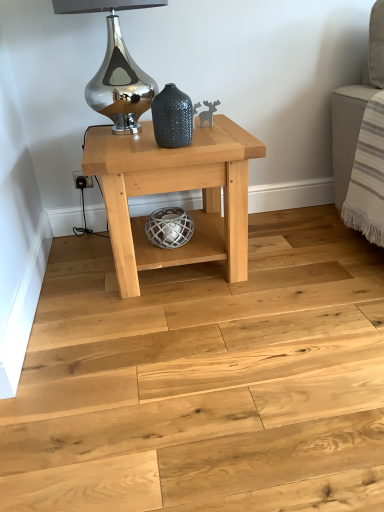
Where is `vacant space to the left of natural wood table at center`? This screenshot has height=512, width=384. vacant space to the left of natural wood table at center is located at coordinates (78, 274).